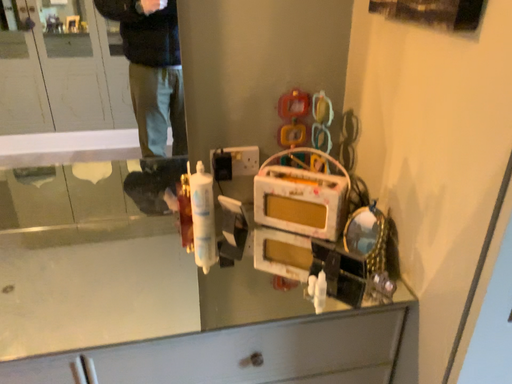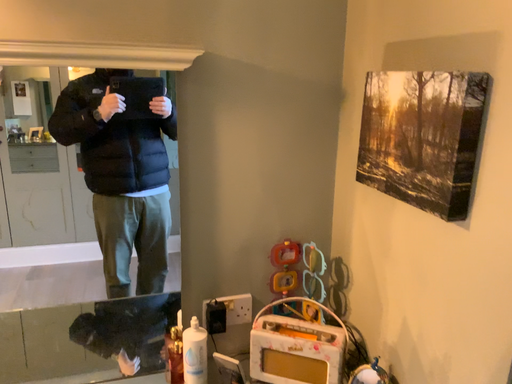
Question: How did the camera likely rotate when shooting the video?

Choices:
 (A) rotated downward
 (B) rotated upward

Answer: (B)